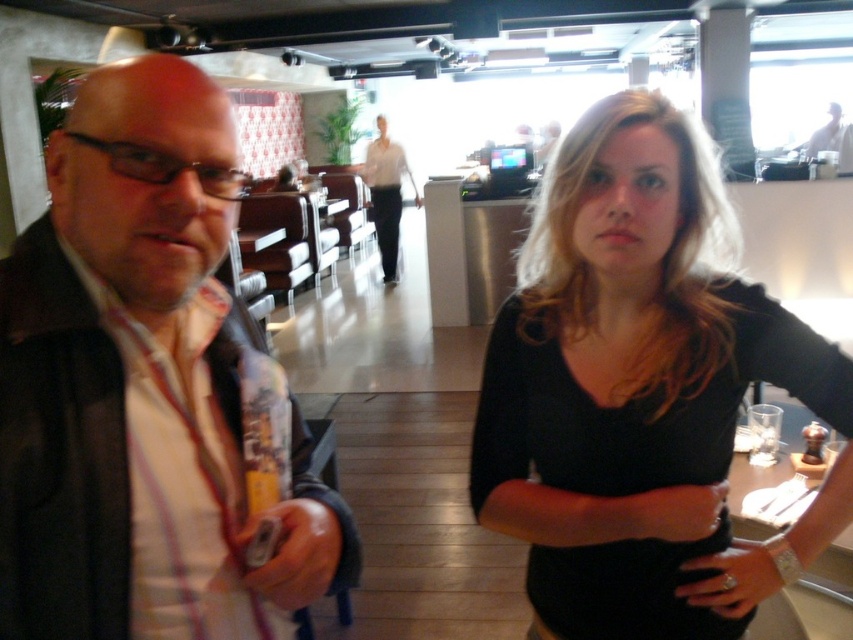
Question: Which point is closer to the camera?

Choices:
 (A) (677, 634)
 (B) (366, 154)

Answer: (A)

Question: Can you confirm if black matte shirt at center is positioned to the left of matte white blouse at center?

Choices:
 (A) yes
 (B) no

Answer: (B)

Question: Considering the relative positions of matte black jacket at left and black matte shirt at center in the image provided, where is matte black jacket at left located with respect to black matte shirt at center?

Choices:
 (A) above
 (B) below

Answer: (A)

Question: Which object is positioned farthest from the matte white blouse at center?

Choices:
 (A) black matte shirt at center
 (B) matte black jacket at left

Answer: (B)

Question: Estimate the real-world distances between objects in this image. Which object is farther from the black matte shirt at center?

Choices:
 (A) matte white blouse at center
 (B) matte black jacket at left

Answer: (A)

Question: Is matte black jacket at left above matte white blouse at center?

Choices:
 (A) no
 (B) yes

Answer: (A)